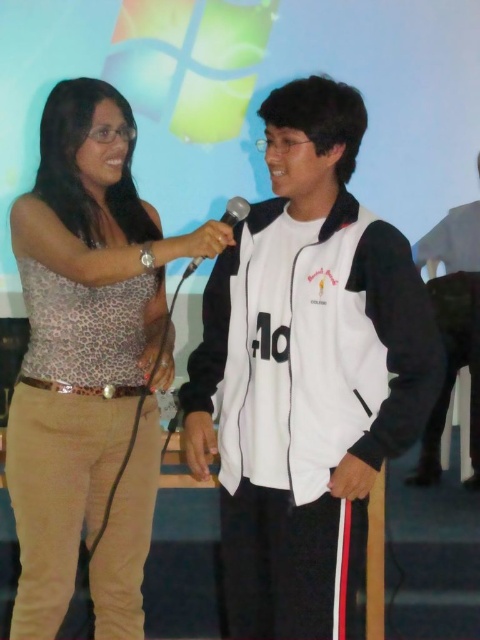
Can you confirm if white matte jacket at center is taller than leopard print tank top at left?

In fact, white matte jacket at center may be shorter than leopard print tank top at left.

Which of these two, white matte jacket at center or leopard print tank top at left, stands taller?

Standing taller between the two is leopard print tank top at left.

Locate an element on the screen. This screenshot has height=640, width=480. white matte jacket at center is located at coordinates (307, 372).

What are the coordinates of `white matte jacket at center` in the screenshot? It's located at (307, 372).

The height and width of the screenshot is (640, 480). What do you see at coordinates (81, 333) in the screenshot?
I see `leopard print tank top at left` at bounding box center [81, 333].

Between point (121, 145) and point (226, 205), which one is positioned in front?

Point (121, 145) is in front.

The height and width of the screenshot is (640, 480). Describe the element at coordinates (81, 333) in the screenshot. I see `leopard print tank top at left` at that location.

The width and height of the screenshot is (480, 640). In order to click on leopard print tank top at left in this screenshot , I will do `click(81, 333)`.

Is white matte jacket at center to the right of black metallic microphone at center from the viewer's perspective?

Yes, white matte jacket at center is to the right of black metallic microphone at center.

This screenshot has width=480, height=640. What do you see at coordinates (307, 372) in the screenshot?
I see `white matte jacket at center` at bounding box center [307, 372].

Who is more distant from viewer, (334, 83) or (236, 198)?

Point (236, 198)

Locate an element on the screen. This screenshot has height=640, width=480. white matte jacket at center is located at coordinates (307, 372).